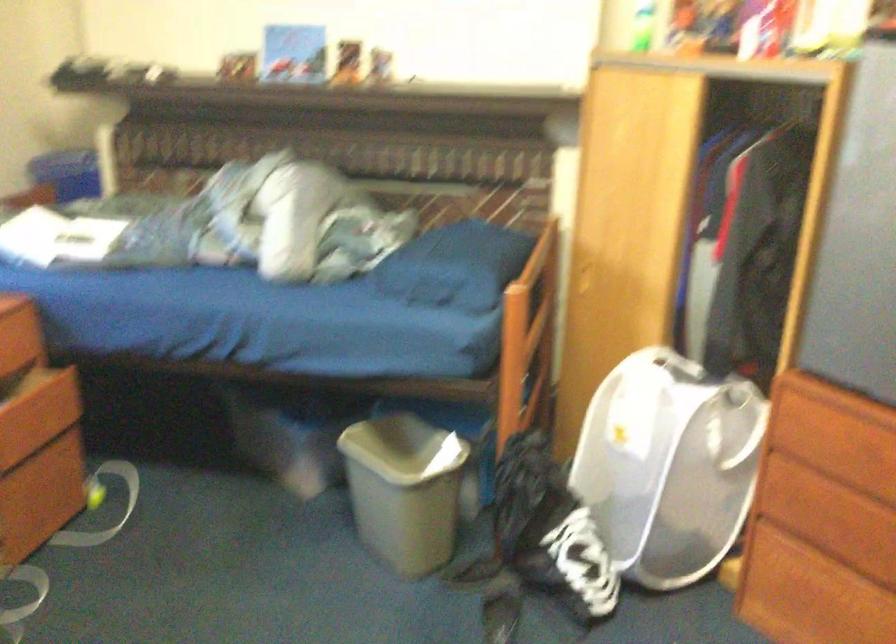
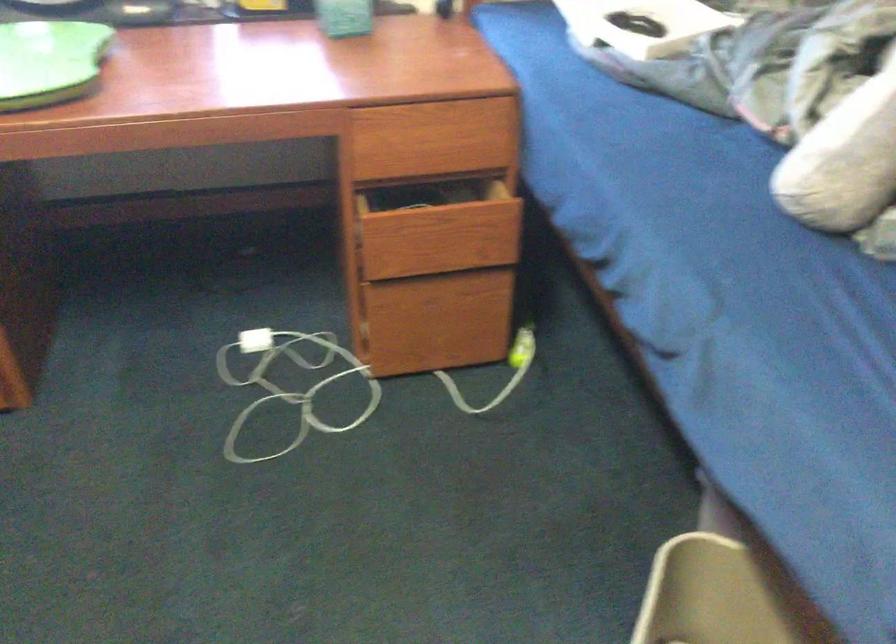
The point at (90,489) is marked in the first image. Where is the corresponding point in the second image?

(521, 346)